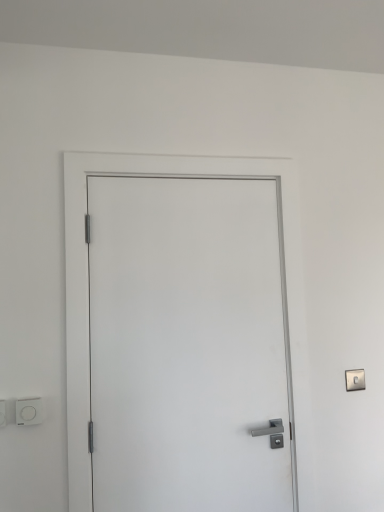
Question: Considering the positions of white plastic light switch at lower left and white matte door at center in the image, is white plastic light switch at lower left bigger or smaller than white matte door at center?

Choices:
 (A) small
 (B) big

Answer: (A)

Question: Choose the correct answer: Is white plastic light switch at lower left inside white matte door at center or outside it?

Choices:
 (A) outside
 (B) inside

Answer: (A)

Question: From the image's perspective, is white plastic light switch at lower left above or below white matte door at center?

Choices:
 (A) below
 (B) above

Answer: (A)

Question: Looking at their shapes, would you say white matte door at center is wider or thinner than white plastic light switch at lower left?

Choices:
 (A) wide
 (B) thin

Answer: (A)

Question: From a real-world perspective, relative to white plastic light switch at lower left, is white matte door at center vertically above or below?

Choices:
 (A) below
 (B) above

Answer: (B)

Question: Is white matte door at center inside or outside of white plastic light switch at lower left?

Choices:
 (A) outside
 (B) inside

Answer: (A)

Question: Is white matte door at center in front of or behind white plastic light switch at lower left in the image?

Choices:
 (A) behind
 (B) front

Answer: (B)